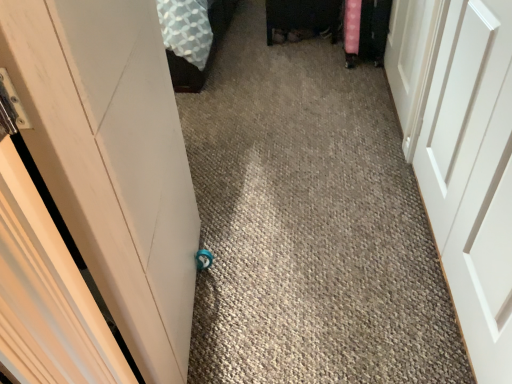
Question: Considering the relative positions of white matte door at left, positioned as the first door in left-to-right order, and white matte door at center, which ranks as the 2th door in left-to-right order, in the image provided, is white matte door at left, positioned as the first door in left-to-right order, behind white matte door at center, which ranks as the 2th door in left-to-right order,?

Choices:
 (A) yes
 (B) no

Answer: (B)

Question: Is white matte door at left, arranged as the 3th door when viewed from the right, to the left of white matte door at center, which appears as the second door when viewed from the right, from the viewer's perspective?

Choices:
 (A) yes
 (B) no

Answer: (A)

Question: Does white matte door at left, positioned as the first door in left-to-right order, have a lesser width compared to white matte door at center, which appears as the second door when viewed from the right?

Choices:
 (A) no
 (B) yes

Answer: (A)

Question: Is white matte door at left, arranged as the 3th door when viewed from the right, oriented away from white matte door at center, which ranks as the 2th door in left-to-right order?

Choices:
 (A) no
 (B) yes

Answer: (A)

Question: Can we say white matte door at left, arranged as the 3th door when viewed from the right, lies outside white matte door at center, which ranks as the 2th door in left-to-right order?

Choices:
 (A) yes
 (B) no

Answer: (A)

Question: From a real-world perspective, relative to white matte door at right, which is counted as the 1th door, starting from the right, is white matte door at left, positioned as the first door in left-to-right order, vertically above or below?

Choices:
 (A) below
 (B) above

Answer: (B)

Question: Which is correct: white matte door at left, arranged as the 3th door when viewed from the right, is inside white matte door at right, which is counted as the 1th door, starting from the right, or outside of it?

Choices:
 (A) outside
 (B) inside

Answer: (A)

Question: In terms of width, does white matte door at left, arranged as the 3th door when viewed from the right, look wider or thinner when compared to white matte door at right, which is counted as the 1th door, starting from the right?

Choices:
 (A) thin
 (B) wide

Answer: (B)

Question: Is white matte door at left, arranged as the 3th door when viewed from the right, bigger or smaller than white matte door at right, which is the 3th door from left to right?

Choices:
 (A) big
 (B) small

Answer: (A)

Question: Based on their positions, is white matte door at right, which is the 3th door from left to right, located to the left or right of white matte door at center, which ranks as the 2th door in left-to-right order?

Choices:
 (A) left
 (B) right

Answer: (B)

Question: In terms of size, does white matte door at right, which is the 3th door from left to right, appear bigger or smaller than white matte door at center, which appears as the second door when viewed from the right?

Choices:
 (A) small
 (B) big

Answer: (B)

Question: From the image's perspective, is white matte door at right, which is counted as the 1th door, starting from the right, located above or below white matte door at center, which ranks as the 2th door in left-to-right order?

Choices:
 (A) above
 (B) below

Answer: (A)

Question: Considering the positions of white matte door at right, which is counted as the 1th door, starting from the right, and white matte door at center, which ranks as the 2th door in left-to-right order, in the image, is white matte door at right, which is counted as the 1th door, starting from the right, taller or shorter than white matte door at center, which ranks as the 2th door in left-to-right order,?

Choices:
 (A) tall
 (B) short

Answer: (B)

Question: Is white matte door at center, which appears as the second door when viewed from the right, taller or shorter than white matte door at right, which is counted as the 1th door, starting from the right?

Choices:
 (A) short
 (B) tall

Answer: (B)

Question: Is white matte door at center, which ranks as the 2th door in left-to-right order, wider or thinner than white matte door at right, which is the 3th door from left to right?

Choices:
 (A) thin
 (B) wide

Answer: (A)